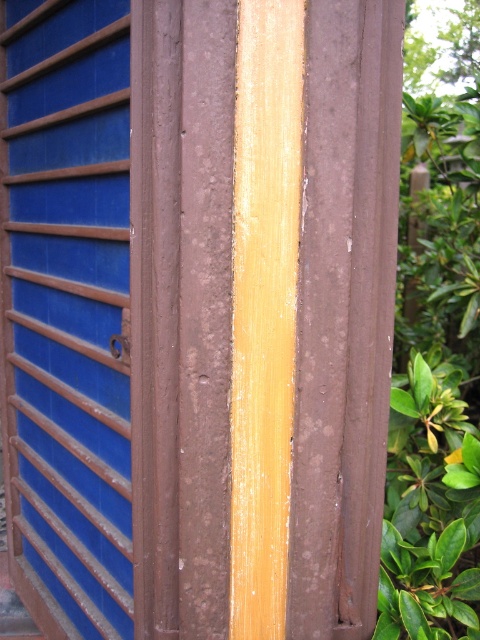
You are an interior designer examining the wooden structure. You need to determine the spatial relationship between the brown matte wood at center and the yellow polished wood at center. Which one is positioned to the right of the other?

The brown matte wood at center is to the right of yellow polished wood at center.

From the picture: You are examining a weathered wooden structure and notice two points marked on it. The first point is at coordinate point (324, 600) and the second is at point (292, 99). From your perspective, which point appears closer to you?

Point (324, 600) is further to the camera than point (292, 99), so the second point at (292, 99) is closer to you.